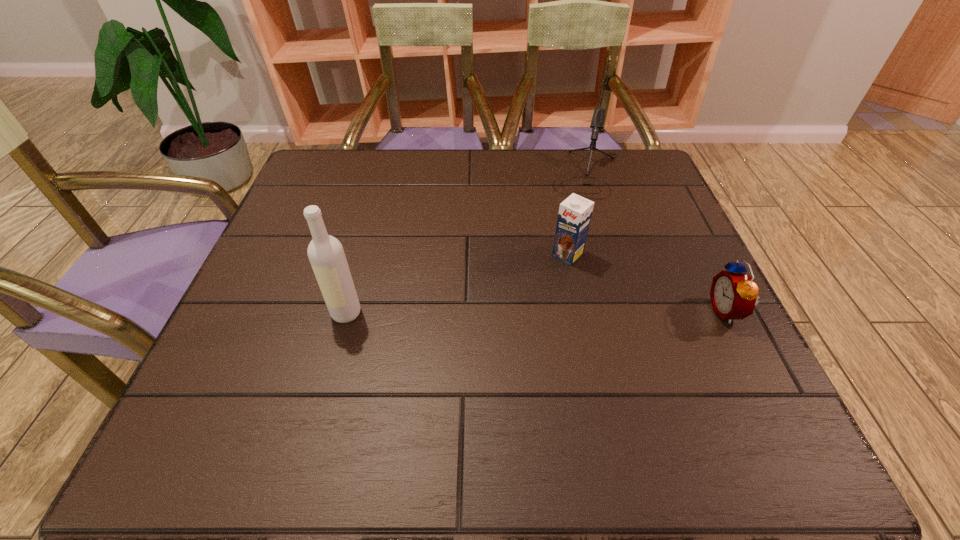
Find the location of a particular element. vacant area situated on the stand of the microphone is located at coordinates (570, 252).

At what (x,y) coordinates should I click in order to perform the action: click on free spot located 0.270m on the stand of the microphone. Please return your answer as a coordinate pair (x, y). This screenshot has height=540, width=960. Looking at the image, I should click on (566, 270).

Identify the location of free space located 0.330m on the front label of the chocolate milk. This screenshot has width=960, height=540. (458, 362).

Where is `free spot located 0.110m on the front label of the chocolate milk`? Image resolution: width=960 pixels, height=540 pixels. free spot located 0.110m on the front label of the chocolate milk is located at coordinates (530, 292).

The image size is (960, 540). In order to click on free space located on the front label of the chocolate milk in this screenshot , I will do `click(521, 301)`.

The height and width of the screenshot is (540, 960). Identify the location of object that is at the far edge. (597, 122).

Where is `alarm clock that is at the right edge`? alarm clock that is at the right edge is located at coordinates (733, 293).

Image resolution: width=960 pixels, height=540 pixels. What are the coordinates of `microphone present at the right edge` in the screenshot? It's located at (597, 122).

You are a GUI agent. You are given a task and a screenshot of the screen. Output one action in this format:
    pyautogui.click(x=<x>, y=<y>)
    Task: Click on the object positioned at the far right corner
    
    Given the screenshot: What is the action you would take?
    pyautogui.click(x=597, y=122)

Where is `free space at the far edge`? The width and height of the screenshot is (960, 540). free space at the far edge is located at coordinates (545, 171).